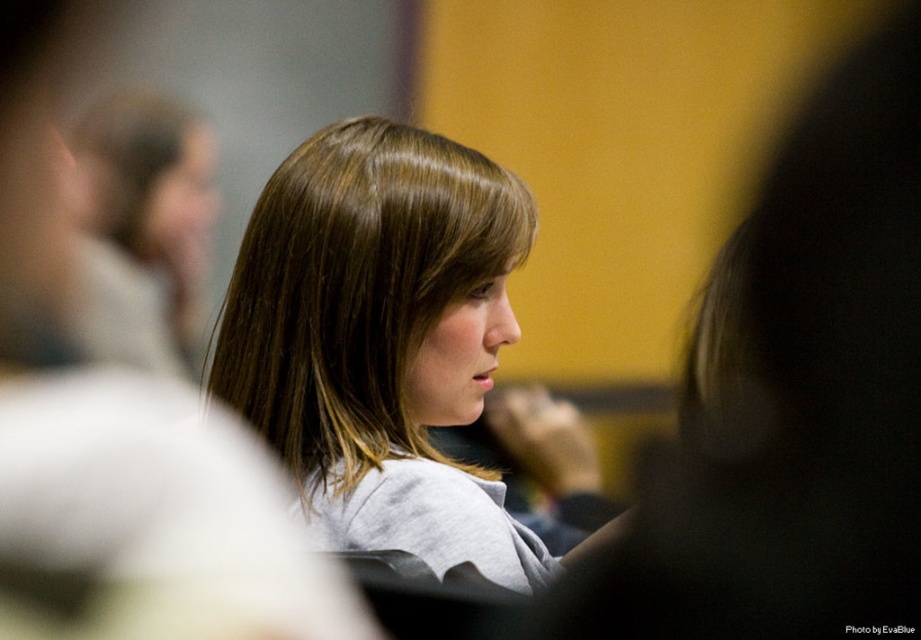
Which of these two, smooth brown hair at center or brown smooth hair at upper left, stands taller?

Standing taller between the two is smooth brown hair at center.

Is the position of smooth brown hair at center less distant than that of brown smooth hair at upper left?

Yes, it is in front of brown smooth hair at upper left.

Identify the location of smooth brown hair at center. This screenshot has width=921, height=640. (383, 340).

I want to click on smooth brown hair at center, so 383,340.